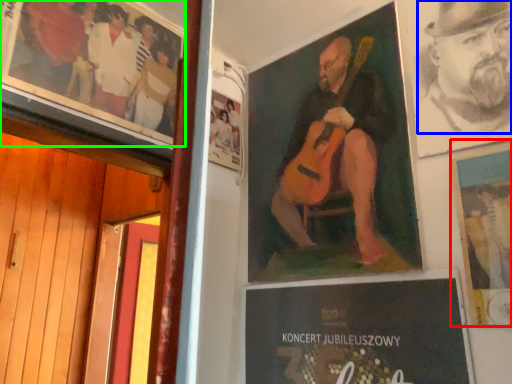
Question: Which is nearer to the poster (highlighted by a red box)? person (highlighted by a blue box) or poster (highlighted by a green box).

Choices:
 (A) person
 (B) poster

Answer: (A)